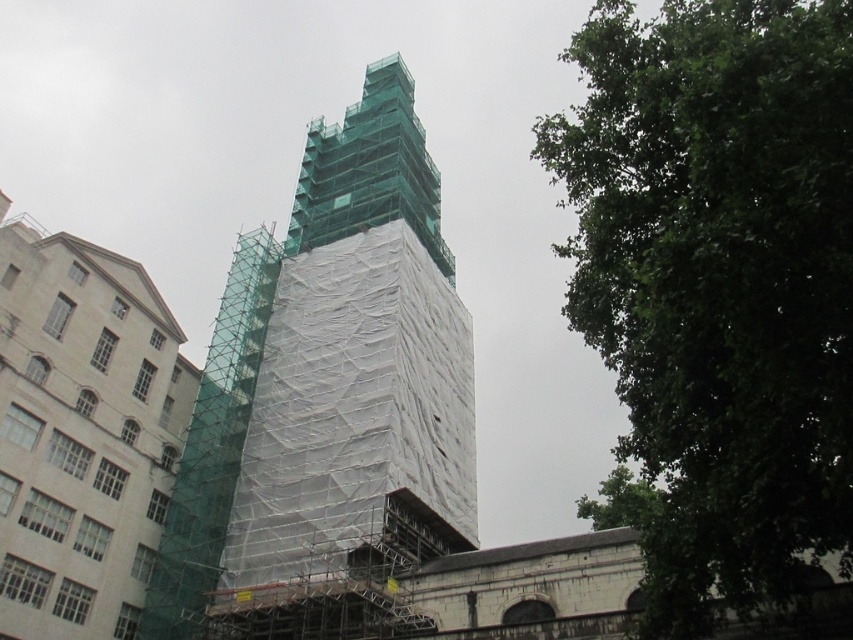
Can you confirm if green leafy tree at upper right is thinner than green scaffolding at center?

In fact, green leafy tree at upper right might be wider than green scaffolding at center.

Between green leafy tree at upper right and green scaffolding at center, which one has more height?

green leafy tree at upper right is taller.

Which is behind, point (830, 49) or point (462, 364)?

The point (462, 364) is more distant.

You are a GUI agent. You are given a task and a screenshot of the screen. Output one action in this format:
    pyautogui.click(x=<x>, y=<y>)
    Task: Click on the green leafy tree at upper right
    Image resolution: width=853 pixels, height=640 pixels.
    Given the screenshot: What is the action you would take?
    pyautogui.click(x=717, y=285)